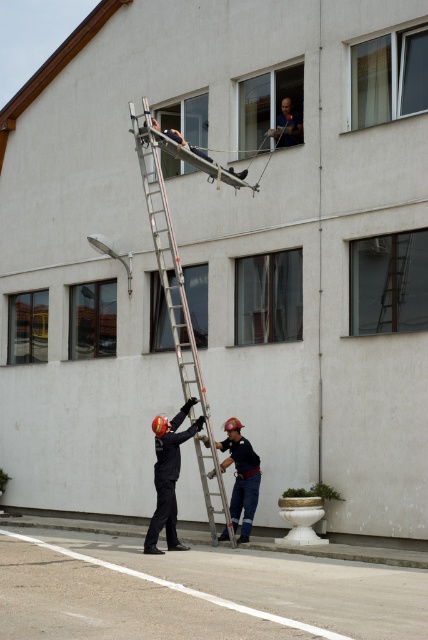
Question: Among these points, which one is farthest from the camera?

Choices:
 (A) (41, 316)
 (B) (386, 106)
 (C) (193, 276)

Answer: (A)

Question: Is silver metallic ladder at center further to the viewer compared to clear glass window at upper center?

Choices:
 (A) no
 (B) yes

Answer: (A)

Question: Which of these objects is positioned closest to the clear glass window at center?

Choices:
 (A) transparent glass window at lower left
 (B) transparent glass window at center

Answer: (B)

Question: Can you confirm if white plastic window at upper center is positioned to the right of transparent glass window at lower left?

Choices:
 (A) yes
 (B) no

Answer: (A)

Question: Estimate the real-world distances between objects in this image. Which object is closer to the clear glass window at upper center?

Choices:
 (A) white plastic window at upper center
 (B) transparent glass window at upper center
 (C) transparent glass window at center right
 (D) clear glass window at lower left

Answer: (B)

Question: Does transparent glass window at upper center have a lesser width compared to dark blue uniform at lower center?

Choices:
 (A) yes
 (B) no

Answer: (B)